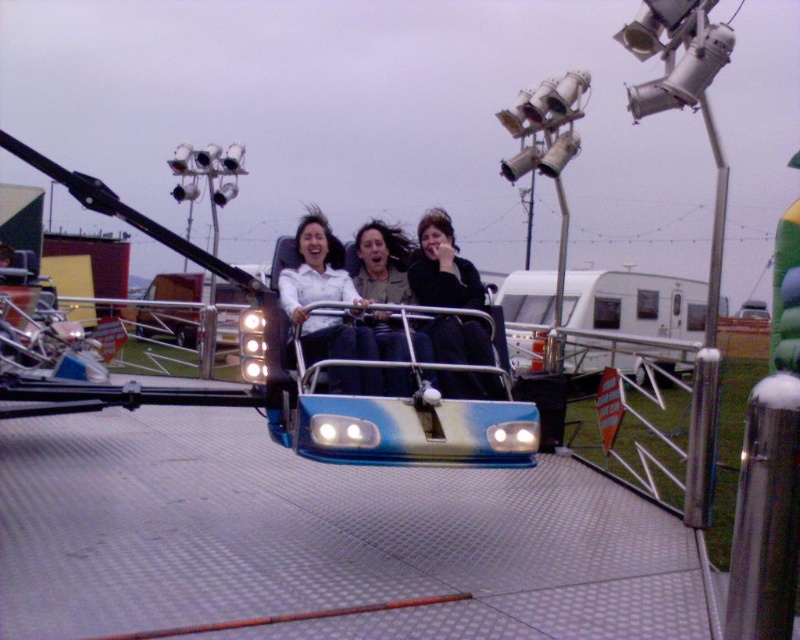
You are a photographer at the fairground. You need to capture a clear photo of both the black matte jacket at center and the matte black jacket at center. Which jacket should you focus on first to ensure it appears larger in the photo?

The black matte jacket at center should be focused on first because it has a larger size compared to the matte black jacket at center, ensuring it appears bigger in the photo.

You are a maintenance worker who needs to inspect the distance between the black matte jacket at center and the nearest ride vehicle. Can you confirm if the distance is more than 4 meters?

The black matte jacket at center and the nearest ride vehicle are 4.35 meters apart, so yes, the distance is more than 4 meters.

In the scene shown: You are standing in the fairground and want to take a photo of the two people wearing the matte white shirt at center and the matte black jacket at center. Which one will appear larger in your photo?

The matte white shirt at center will appear larger in the photo because it is closer to the viewer than the matte black jacket at center.